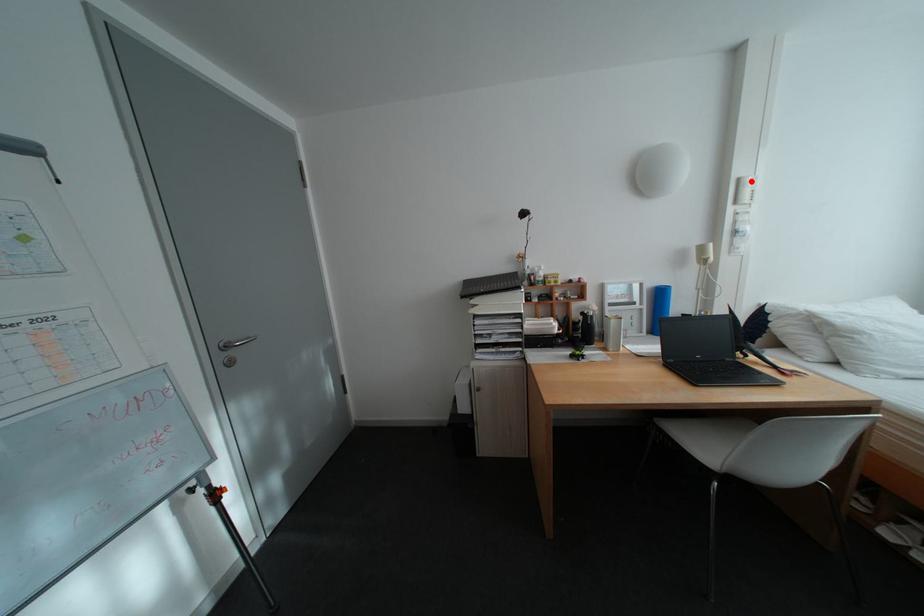
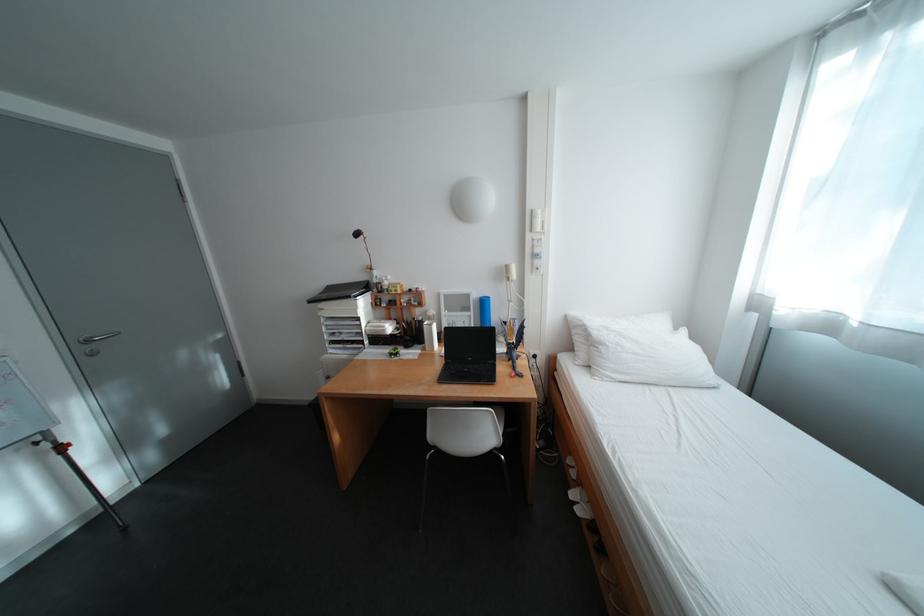
The point at the highlighted location is marked in the first image. Where is the corresponding point in the second image?

(544, 213)